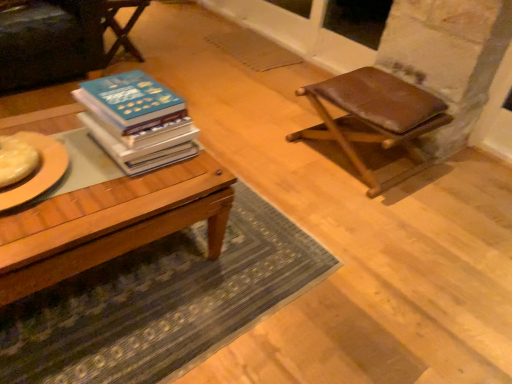
The height and width of the screenshot is (384, 512). Find the location of `free space above green textured rug at lower center (from a real-world perspective)`. free space above green textured rug at lower center (from a real-world perspective) is located at coordinates (173, 280).